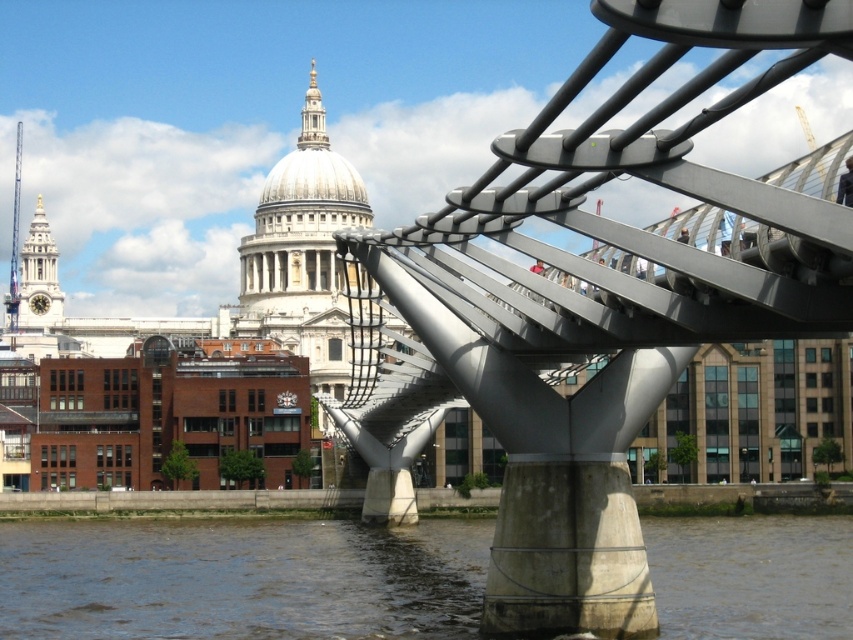
Which is behind, point (685, 320) or point (57, 625)?

The point (57, 625) is more distant.

Is metallic silver suspension bridge at center behind brown water at lower center?

No, metallic silver suspension bridge at center is in front of brown water at lower center.

Image resolution: width=853 pixels, height=640 pixels. I want to click on metallic silver suspension bridge at center, so click(595, 307).